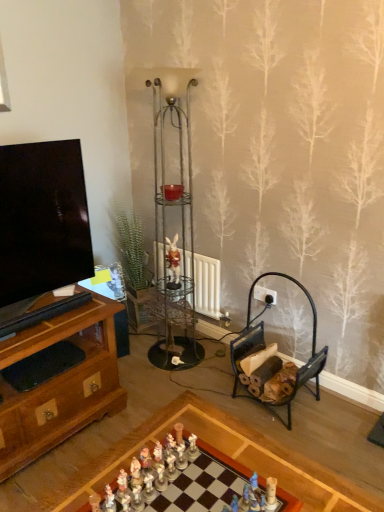
You are a GUI agent. You are given a task and a screenshot of the screen. Output one action in this format:
    pyautogui.click(x=<x>, y=<y>)
    Task: Click on the free space in front of metallic wire shelving unit at center
    
    Given the screenshot: What is the action you would take?
    pos(160,386)